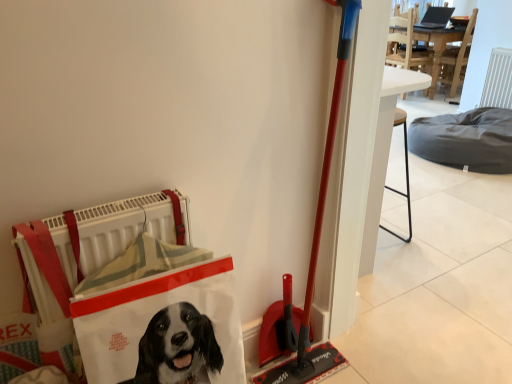
Question: From a real-world perspective, is dark gray fabric dog bed at center-right located beneath white fabric shopping bag at lower left?

Choices:
 (A) yes
 (B) no

Answer: (A)

Question: Can you confirm if dark gray fabric dog bed at center-right is thinner than white fabric shopping bag at lower left?

Choices:
 (A) yes
 (B) no

Answer: (B)

Question: Does dark gray fabric dog bed at center-right appear on the right side of white fabric shopping bag at lower left?

Choices:
 (A) yes
 (B) no

Answer: (A)

Question: Does dark gray fabric dog bed at center-right have a smaller size compared to white fabric shopping bag at lower left?

Choices:
 (A) yes
 (B) no

Answer: (B)

Question: Is dark gray fabric dog bed at center-right taller than white fabric shopping bag at lower left?

Choices:
 (A) yes
 (B) no

Answer: (B)

Question: Considering the relative sizes of dark gray fabric dog bed at center-right and white fabric shopping bag at lower left in the image provided, is dark gray fabric dog bed at center-right shorter than white fabric shopping bag at lower left?

Choices:
 (A) yes
 (B) no

Answer: (A)

Question: Considering the relative sizes of white fabric shopping bag at lower left and dark gray fabric dog bed at center-right in the image provided, is white fabric shopping bag at lower left thinner than dark gray fabric dog bed at center-right?

Choices:
 (A) no
 (B) yes

Answer: (B)

Question: Is dark gray fabric dog bed at center-right surrounded by white fabric shopping bag at lower left?

Choices:
 (A) no
 (B) yes

Answer: (A)

Question: Is white fabric shopping bag at lower left closer to camera compared to dark gray fabric dog bed at center-right?

Choices:
 (A) yes
 (B) no

Answer: (A)

Question: Is white fabric shopping bag at lower left completely or partially outside of dark gray fabric dog bed at center-right?

Choices:
 (A) yes
 (B) no

Answer: (A)

Question: Could you tell me if white fabric shopping bag at lower left is turned towards dark gray fabric dog bed at center-right?

Choices:
 (A) no
 (B) yes

Answer: (A)

Question: Does white fabric shopping bag at lower left have a lesser height compared to dark gray fabric dog bed at center-right?

Choices:
 (A) no
 (B) yes

Answer: (A)

Question: Visually, is dark gray fabric dog bed at center-right positioned to the left or to the right of white fabric shopping bag at lower left?

Choices:
 (A) left
 (B) right

Answer: (B)